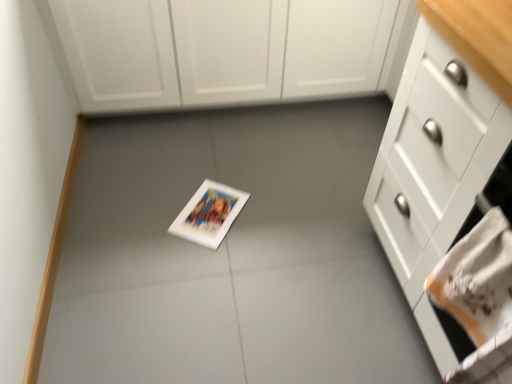
Question: Visually, is white glossy cabinet at right, the 2th cabinetry in the back-to-front sequence, positioned to the left or to the right of white matte cabinet at upper center, placed as the second cabinetry when sorted from front to back?

Choices:
 (A) right
 (B) left

Answer: (A)

Question: From a real-world perspective, is white glossy cabinet at right, which appears as the 1th cabinetry when ordered from the bottom, above or below white matte cabinet at upper center, acting as the first cabinetry starting from the top?

Choices:
 (A) above
 (B) below

Answer: (A)

Question: Which object is positioned farthest from the white glossy cabinet at right, the 2th cabinetry in the back-to-front sequence?

Choices:
 (A) white embroidered hand towel at lower right
 (B) white matte cabinet at upper center, acting as the first cabinetry starting from the top

Answer: (B)

Question: Considering the real-world distances, which object is farthest from the white embroidered hand towel at lower right?

Choices:
 (A) white matte cabinet at upper center, acting as the first cabinetry starting from the top
 (B) white glossy cabinet at right, the second cabinetry in the top-to-bottom sequence

Answer: (A)